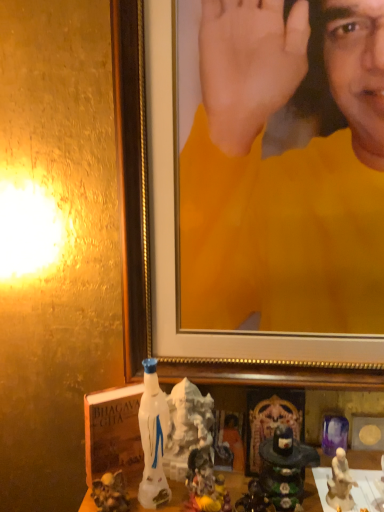
Describe the element at coordinates (153, 439) in the screenshot. I see `white glossy statue at center` at that location.

Locate an element on the screen. This screenshot has height=512, width=384. white glossy statue at center is located at coordinates (153, 439).

Find the location of `white glossy statue at center`. white glossy statue at center is located at coordinates (153, 439).